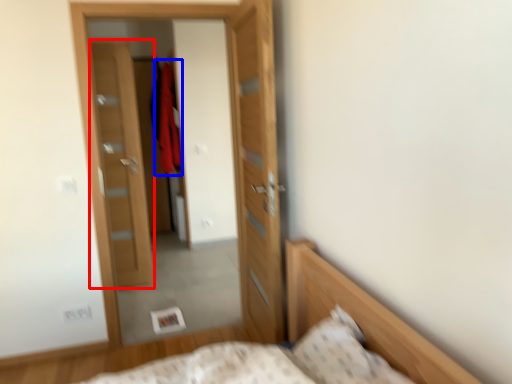
Question: Which of the following is the closest to the observer, door (highlighted by a red box) or robe (highlighted by a blue box)?

Choices:
 (A) door
 (B) robe

Answer: (A)